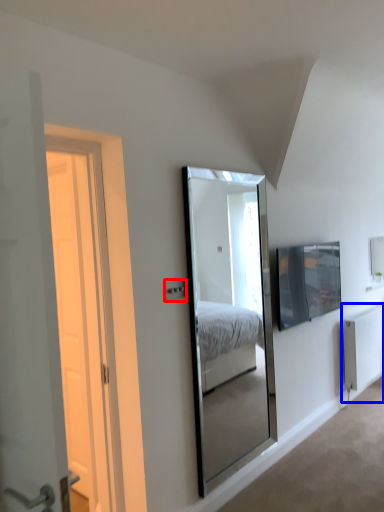
Question: Which object is further to the camera taking this photo, electric outlet (highlighted by a red box) or radiator (highlighted by a blue box)?

Choices:
 (A) electric outlet
 (B) radiator

Answer: (B)